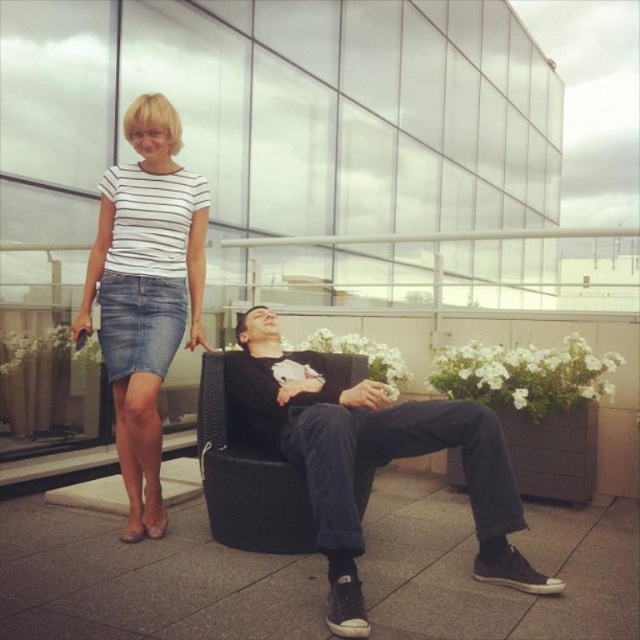
Between black matte chair at center and black woven swivel chair at center, which one is positioned lower?

black woven swivel chair at center is lower down.

Can you confirm if black matte chair at center is wider than black woven swivel chair at center?

Yes, black matte chair at center is wider than black woven swivel chair at center.

You are a GUI agent. You are given a task and a screenshot of the screen. Output one action in this format:
    pyautogui.click(x=<x>, y=<y>)
    Task: Click on the black matte chair at center
    The width and height of the screenshot is (640, 640).
    Given the screenshot: What is the action you would take?
    pyautogui.click(x=368, y=456)

Is point (492, 508) positioned behind point (170, 196)?

No, it is not.

This screenshot has height=640, width=640. In order to click on black matte chair at center in this screenshot , I will do `click(368, 456)`.

Find the location of a particular element. black matte chair at center is located at coordinates (x=368, y=456).

Locate an element on the screen. This screenshot has height=640, width=640. black matte chair at center is located at coordinates (368, 456).

Which of these two, denim skirt at left or black woven swivel chair at center, stands shorter?

With less height is black woven swivel chair at center.

Is denim skirt at left above black woven swivel chair at center?

Correct, denim skirt at left is located above black woven swivel chair at center.

Locate an element on the screen. The width and height of the screenshot is (640, 640). denim skirt at left is located at coordinates (145, 292).